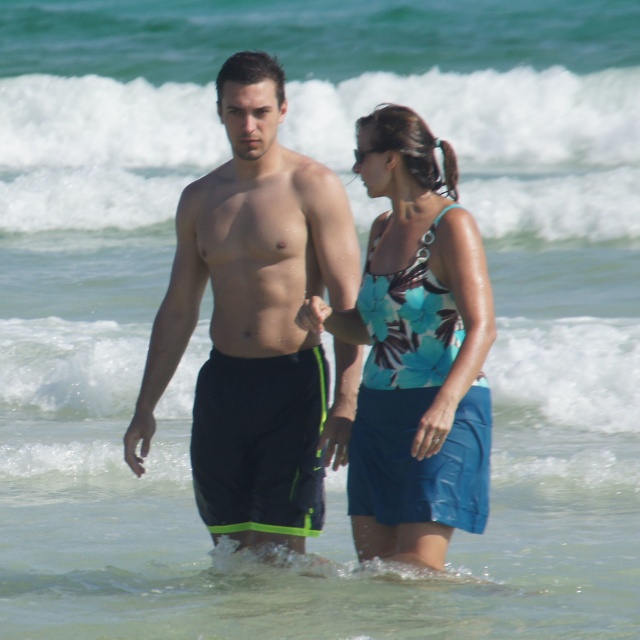
Question: Among these points, which one is nearest to the camera?

Choices:
 (A) (316, 326)
 (B) (292, 310)

Answer: (A)

Question: Is blue fabric dress at center positioned before matte black hand at center?

Choices:
 (A) yes
 (B) no

Answer: (A)

Question: Which is nearer to the black matte shorts at center?

Choices:
 (A) matte black hand at center
 (B) blue fabric dress at center

Answer: (B)

Question: Which object appears farthest from the camera in this image?

Choices:
 (A) blue fabric dress at center
 (B) matte black hand at center
 (C) black matte shorts at center

Answer: (C)

Question: Does black matte shorts at center appear over blue fabric dress at center?

Choices:
 (A) yes
 (B) no

Answer: (A)

Question: Does black matte shorts at center appear on the left side of matte black hand at center?

Choices:
 (A) no
 (B) yes

Answer: (B)